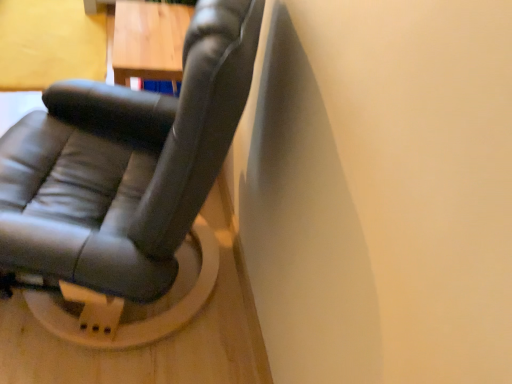
Find the location of a particular element. Image resolution: width=512 pixels, height=384 pixels. vacant area on top of wooden table at upper left (from a real-world perspective) is located at coordinates (155, 17).